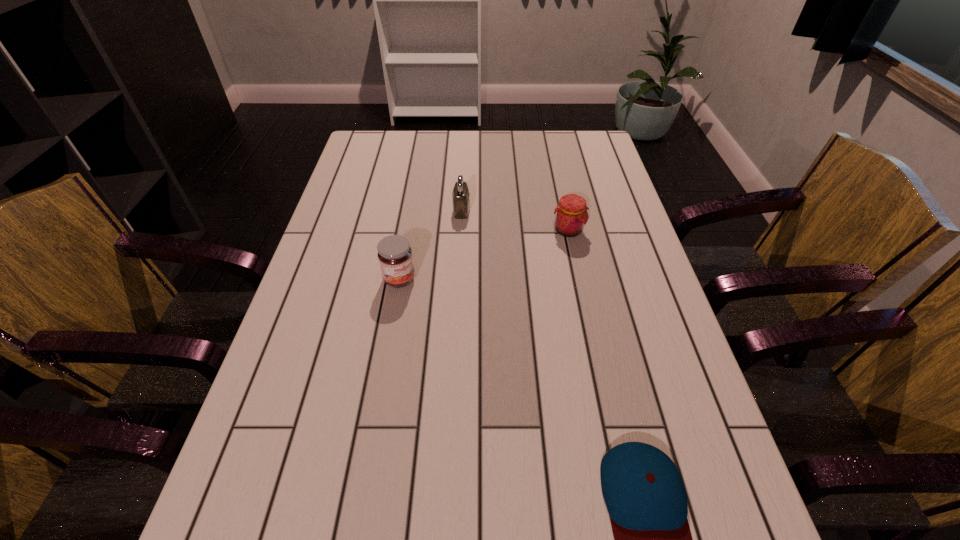
Select which object is the second closest to the nearest object. Please provide its 2D coordinates. Your answer should be formatted as a tuple, i.e. [(x, y)], where the tuple contains the x and y coordinates of a point satisfying the conditions above.

[(571, 215)]

Locate an element on the screen. The width and height of the screenshot is (960, 540). free space in the image that satisfies the following two spatial constraints: 1. at the front of the farther jam near the keyhole; 2. on the right side of the farthest object is located at coordinates (461, 230).

You are a GUI agent. You are given a task and a screenshot of the screen. Output one action in this format:
    pyautogui.click(x=<x>, y=<y>)
    Task: Click on the vacant space that satisfies the following two spatial constraints: 1. at the front of the padlock near the keyhole; 2. on the front side of the nearer jam
    This screenshot has width=960, height=540.
    Given the screenshot: What is the action you would take?
    pyautogui.click(x=458, y=279)